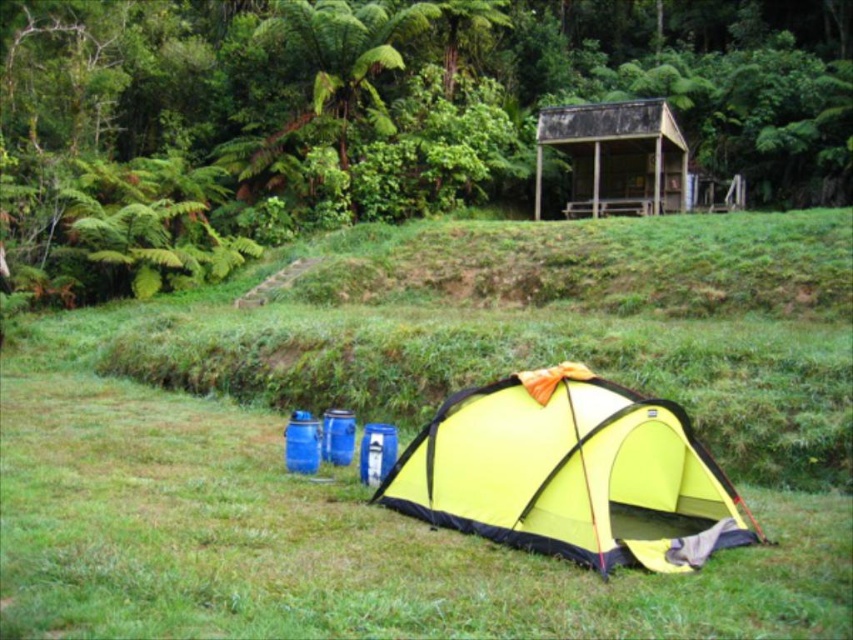
Question: Among these objects, which one is farthest from the camera?

Choices:
 (A) weathered wood hut at upper center
 (B) yellow fabric tent at lower center
 (C) green grassy at lower center

Answer: (A)

Question: Which point is closer to the camera?

Choices:
 (A) 589,154
 (B) 447,497

Answer: (B)

Question: Does yellow fabric tent at lower center have a larger size compared to weathered wood hut at upper center?

Choices:
 (A) no
 (B) yes

Answer: (B)

Question: Can you confirm if green grassy at lower center is positioned above yellow fabric tent at lower center?

Choices:
 (A) yes
 (B) no

Answer: (A)

Question: Which of the following is the closest to the observer?

Choices:
 (A) yellow fabric tent at lower center
 (B) green grassy at lower center
 (C) weathered wood hut at upper center

Answer: (B)

Question: Does yellow fabric tent at lower center have a smaller size compared to weathered wood hut at upper center?

Choices:
 (A) no
 (B) yes

Answer: (A)